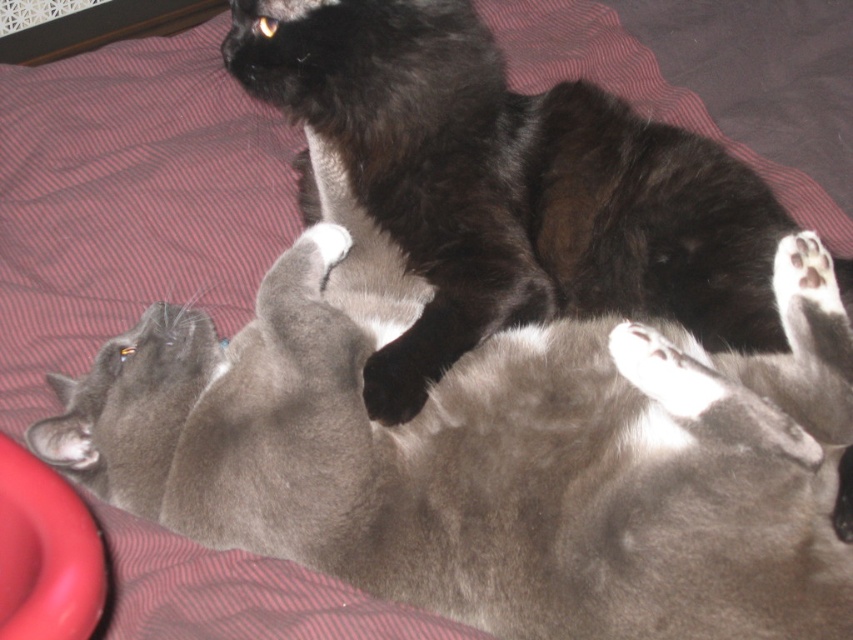
Based on the photo, does soft gray cat at center have a lesser width compared to black fluffy cat at upper center?

No.

Is soft gray cat at center below black fluffy cat at upper center?

Yes.

You are a GUI agent. You are given a task and a screenshot of the screen. Output one action in this format:
    pyautogui.click(x=<x>, y=<y>)
    Task: Click on the soft gray cat at center
    Image resolution: width=853 pixels, height=640 pixels.
    Given the screenshot: What is the action you would take?
    pyautogui.click(x=490, y=456)